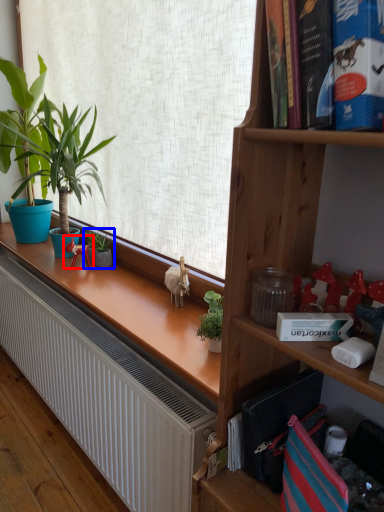
Question: Among these objects, which one is nearest to the camera, toy (highlighted by a red box) or houseplant (highlighted by a blue box)?

Choices:
 (A) toy
 (B) houseplant

Answer: (A)